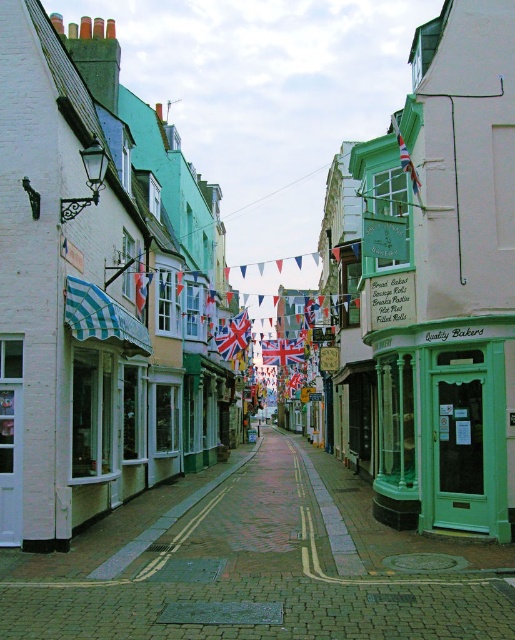
Measure the distance from union jack fabric flag at center to union jack fabric flag at upper right.

The distance of union jack fabric flag at center from union jack fabric flag at upper right is 92.67 feet.

Between union jack fabric flag at center and union jack fabric flag at upper right, which one has less height?

Standing shorter between the two is union jack fabric flag at center.

Looking at this image, measure the distance between point (238, 330) and camera.

Point (238, 330) is 116.87 feet from camera.

I want to click on union jack fabric flag at center, so click(x=233, y=336).

Who is higher up, green glass door at center or union jack fabric flag at center?

union jack fabric flag at center is higher up.

Is point (152, 612) behind point (228, 328)?

That is False.

Between point (414, 625) and point (227, 340), which one is positioned in front?

Point (414, 625) is more forward.

You are a GUI agent. You are given a task and a screenshot of the screen. Output one action in this format:
    pyautogui.click(x=<x>, y=<y>)
    Task: Click on the green glass door at center
    This screenshot has height=640, width=515.
    Given the screenshot: What is the action you would take?
    point(258,563)

Is the position of green glass door at center less distant than that of union jack fabric flag at upper right?

That is True.

Between green glass door at center and union jack fabric flag at upper right, which one is positioned lower?

green glass door at center is below.

Is point (204, 576) farther from viewer compared to point (421, 202)?

That is False.

At what (x,y) coordinates should I click in order to perform the action: click on green glass door at center. Please return your answer as a coordinate pair (x, y). The width and height of the screenshot is (515, 640). Looking at the image, I should click on (258, 563).